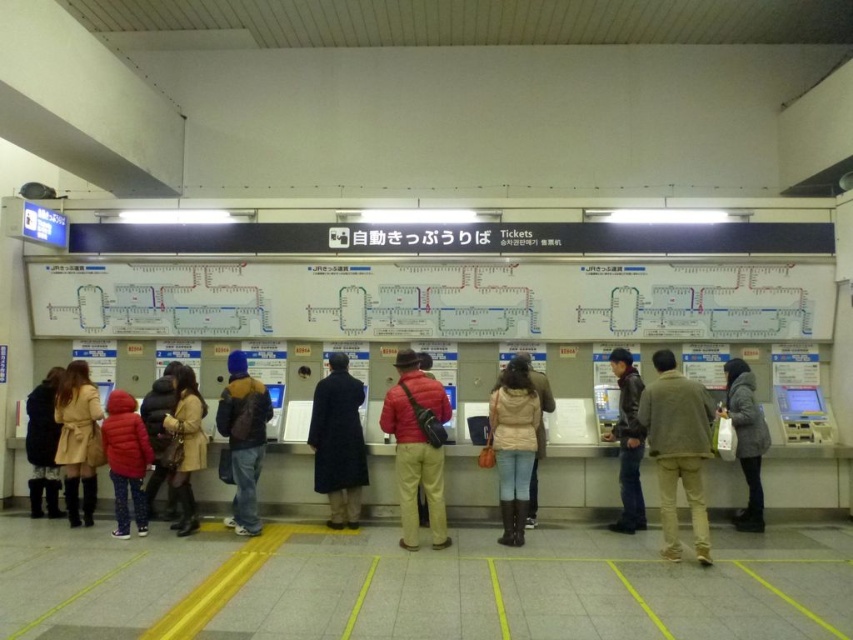
Question: Is light brown leather boots at center bigger than dark gray wool coat at right?

Choices:
 (A) no
 (B) yes

Answer: (A)

Question: Which is nearer to the khaki cotton pants at center?

Choices:
 (A) leather jacket at center
 (B) beige leather coat at lower left
 (C) matte red jacket at center
 (D) velvet black coat at lower left

Answer: (A)

Question: Which point appears closest to the camera in this image?

Choices:
 (A) (735, 422)
 (B) (329, 522)

Answer: (A)

Question: Is matte red jacket at center behind velvet black coat at lower left?

Choices:
 (A) yes
 (B) no

Answer: (B)

Question: Which object is farther from the camera taking this photo?

Choices:
 (A) light brown leather boots at center
 (B) dark blue coat at center

Answer: (B)

Question: Is dark blue coat at center bigger than velvet black coat at lower left?

Choices:
 (A) no
 (B) yes

Answer: (B)